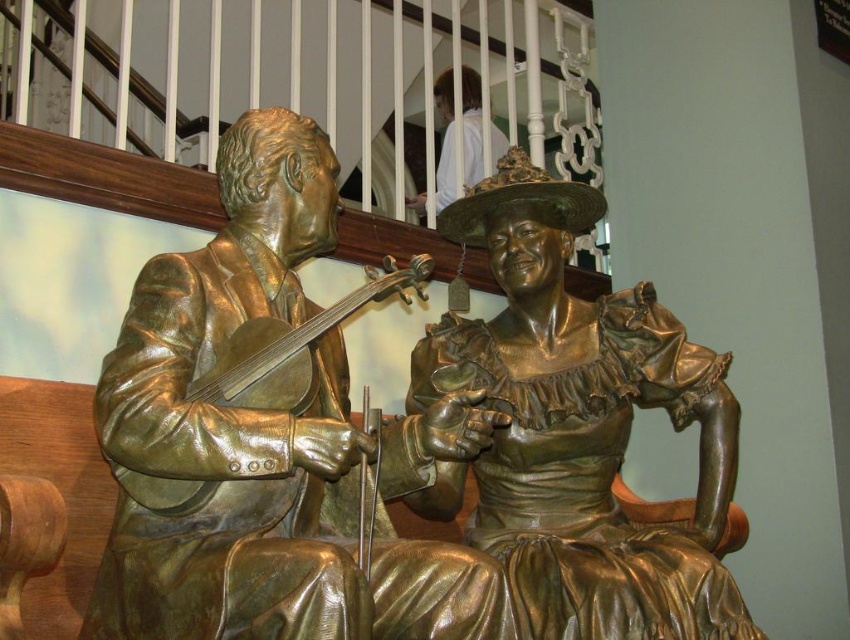
Which is in front, point (378, 570) or point (449, 163)?

Point (378, 570)

How far apart are bronze violinist at center and white fabric at upper center?

The distance of bronze violinist at center from white fabric at upper center is 47.36 feet.

Who is more distant from viewer, (x=238, y=291) or (x=468, y=188)?

The point (x=468, y=188) is behind.

The image size is (850, 640). In order to click on bronze violinist at center in this screenshot , I will do `click(256, 444)`.

Which is above, bronze violinist at center or bronze statue at center?

bronze statue at center is above.

Which is behind, point (327, 337) or point (639, 564)?

Positioned behind is point (327, 337).

The width and height of the screenshot is (850, 640). Find the location of `bronze violinist at center`. bronze violinist at center is located at coordinates (256, 444).

Is bronze statue at center above white fabric at upper center?

Actually, bronze statue at center is below white fabric at upper center.

Is point (654, 570) less distant than point (416, 211)?

Yes.

This screenshot has height=640, width=850. Describe the element at coordinates (581, 426) in the screenshot. I see `bronze statue at center` at that location.

At what (x,y) coordinates should I click in order to perform the action: click on bronze statue at center. Please return your answer as a coordinate pair (x, y). Looking at the image, I should click on (581, 426).